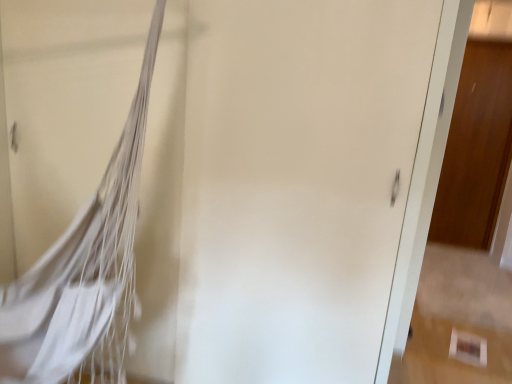
The width and height of the screenshot is (512, 384). What do you see at coordinates (84, 272) in the screenshot? I see `white fabric hammock at left` at bounding box center [84, 272].

I want to click on white fabric hammock at left, so click(84, 272).

From the picture: What is the approximate width of white fabric hammock at left?

The width of white fabric hammock at left is 11.37 inches.

Describe the element at coordinates (476, 149) in the screenshot. The width and height of the screenshot is (512, 384). I see `wooden door at right` at that location.

This screenshot has width=512, height=384. Find the location of `wooden door at right`. wooden door at right is located at coordinates (476, 149).

Measure the distance between point [503,42] and camera.

Point [503,42] and camera are 3.92 meters apart from each other.

Image resolution: width=512 pixels, height=384 pixels. What are the coordinates of `white fabric hammock at left` in the screenshot? It's located at (84, 272).

Which is more to the right, wooden door at right or white fabric hammock at left?

Positioned to the right is wooden door at right.

From the picture: Is wooden door at right in front of white fabric hammock at left?

No, wooden door at right is further to the viewer.

Between point (457, 180) and point (30, 312), which one is positioned in front?

The point (30, 312) is more forward.

From the image's perspective, is wooden door at right positioned above or below white fabric hammock at left?

From the image's perspective, wooden door at right appears above white fabric hammock at left.

From a real-world perspective, does wooden door at right sit lower than white fabric hammock at left?

Incorrect, from a real-world perspective, wooden door at right is higher than white fabric hammock at left.

Is wooden door at right wider than white fabric hammock at left?

No.

Considering the sizes of objects wooden door at right and white fabric hammock at left in the image provided, who is shorter, wooden door at right or white fabric hammock at left?

white fabric hammock at left is shorter.

Is wooden door at right smaller than white fabric hammock at left?

Yes.

Is wooden door at right not within white fabric hammock at left?

Yes.

Can you see wooden door at right touching white fabric hammock at left?

No.

Is wooden door at right turned away from white fabric hammock at left?

No, white fabric hammock at left is not at the back of wooden door at right.

What's the angular difference between wooden door at right and white fabric hammock at left's facing directions?

The angular difference between wooden door at right and white fabric hammock at left is 38.9 degrees.

Locate an element on the screen. The width and height of the screenshot is (512, 384). tennis net on the left of the wooden door at right is located at coordinates (84, 272).

Considering the positions of objects white fabric hammock at left and wooden door at right in the image provided, who is more to the right, white fabric hammock at left or wooden door at right?

wooden door at right.

Does white fabric hammock at left lie behind wooden door at right?

No, it is in front of wooden door at right.

Is point (48, 302) closer to camera compared to point (508, 145)?

Yes, point (48, 302) is closer to viewer.

From the image's perspective, which object appears higher, white fabric hammock at left or wooden door at right?

wooden door at right appears higher in the image.

From a real-world perspective, is white fabric hammock at left located beneath wooden door at right?

Yes, from a real-world perspective, white fabric hammock at left is under wooden door at right.

Does white fabric hammock at left have a lesser width compared to wooden door at right?

In fact, white fabric hammock at left might be wider than wooden door at right.

Considering the sizes of objects white fabric hammock at left and wooden door at right in the image provided, who is shorter, white fabric hammock at left or wooden door at right?

white fabric hammock at left is shorter.

Is white fabric hammock at left smaller than wooden door at right?

No, white fabric hammock at left is not smaller than wooden door at right.

Do you think white fabric hammock at left is within wooden door at right, or outside of it?

white fabric hammock at left lies outside wooden door at right.

Would you consider white fabric hammock at left to be distant from wooden door at right?

white fabric hammock at left is far away from wooden door at right.

Could you tell me if white fabric hammock at left is facing wooden door at right?

No, white fabric hammock at left is not oriented towards wooden door at right.

Can you tell me how much white fabric hammock at left and wooden door at right differ in facing direction?

They differ by 38.9 degrees in their facing directions.

Locate an element on the screen. The width and height of the screenshot is (512, 384). tennis net located in front of the wooden door at right is located at coordinates (84, 272).

The height and width of the screenshot is (384, 512). I want to click on door above the white fabric hammock at left (from the image's perspective), so click(476, 149).

Where is `tennis net located below the wooden door at right (from the image's perspective)`? The image size is (512, 384). tennis net located below the wooden door at right (from the image's perspective) is located at coordinates (84, 272).